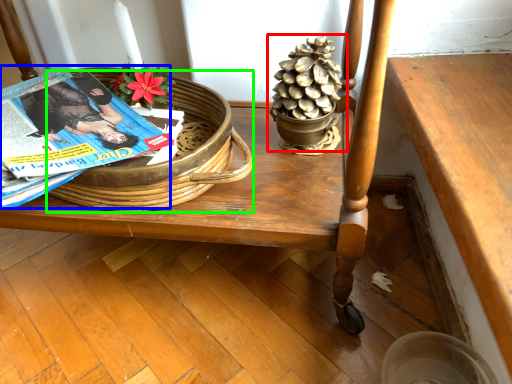
Question: Considering the real-world distances, which object is farthest from houseplant (highlighted by a red box)? magazine (highlighted by a blue box) or basket (highlighted by a green box)?

Choices:
 (A) magazine
 (B) basket

Answer: (A)